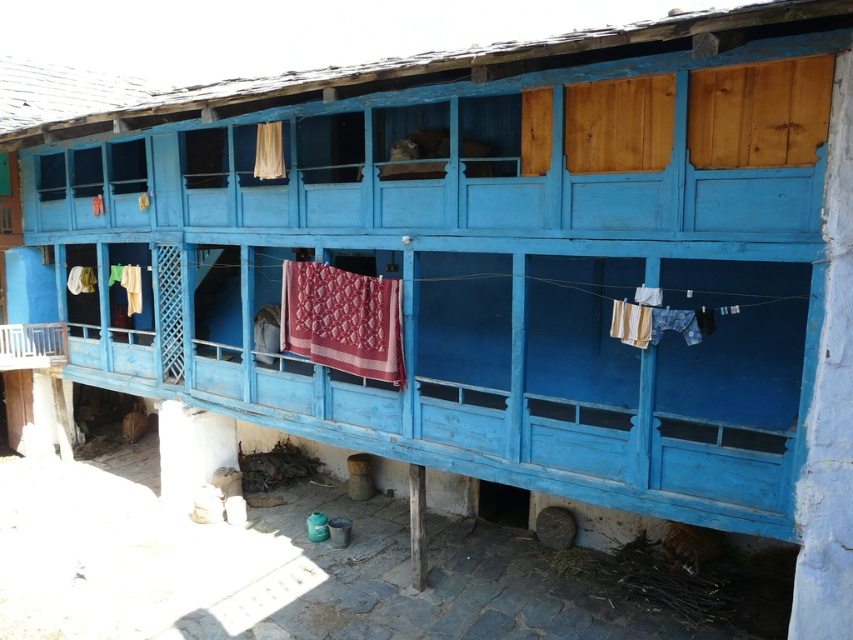
You are a visitor to this traditional blue wooden house. You see a quilted fabric at center and a matte white curtain at upper center. If you want to place a small potted plant between them, will there be enough space?

The quilted fabric at center and the matte white curtain at upper center are 7.65 feet apart, so yes, there is enough space to place a small potted plant between them.

You are an architect designing a new structure and want to incorporate elements from this traditional wooden building. You need to know the relative sizes of the wooden balcony at lower left and the matte white curtain at upper center to ensure proper scaling in your design. Which one has a greater width?

The wooden balcony at lower left has a greater width than the matte white curtain at upper center.